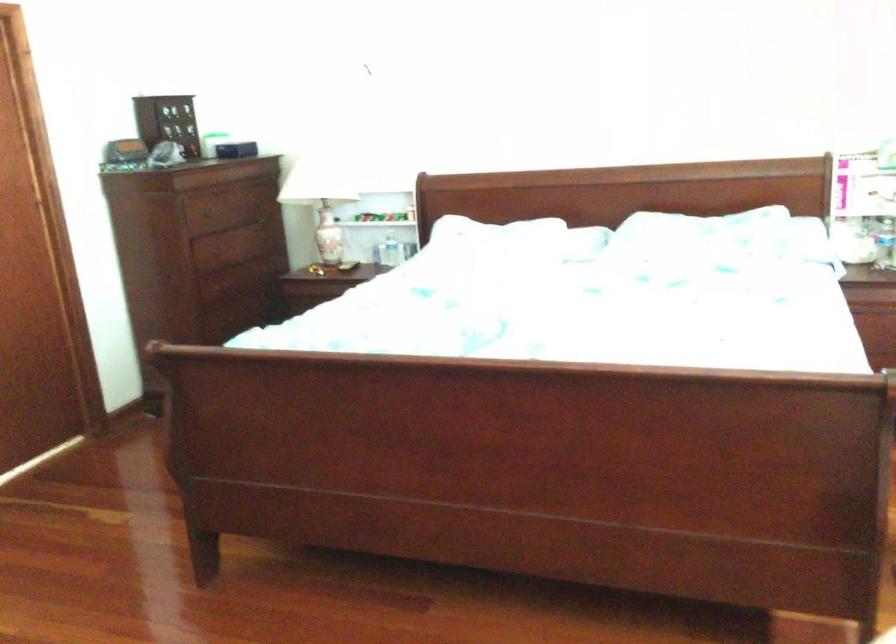
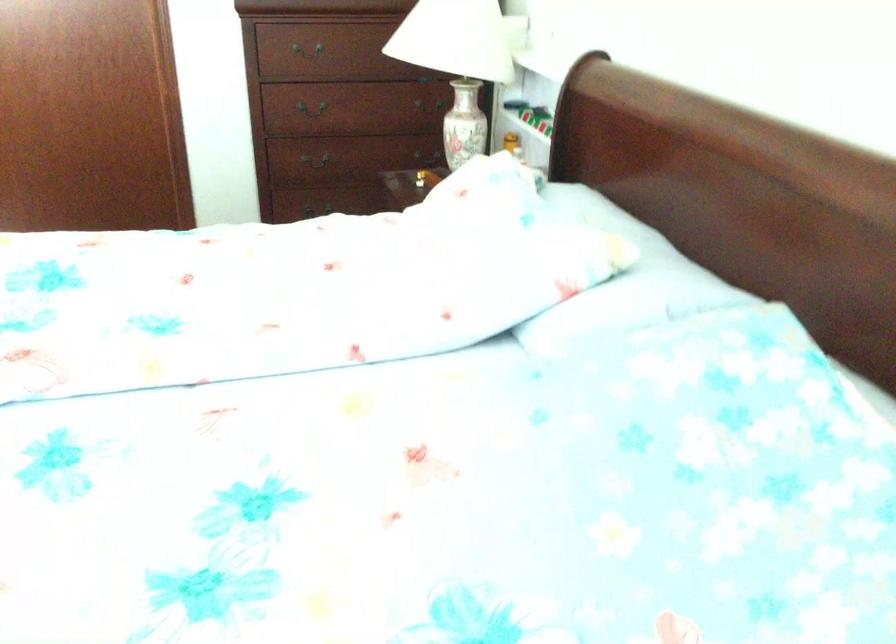
Question: I am providing you with two images of the same scene from different viewpoints. Please identify which objects are invisible in image2.

Choices:
 (A) knife handle
 (B) ceramic flower vase
 (C) metal drawer handle
 (D) plastic water bottle

Answer: (D)